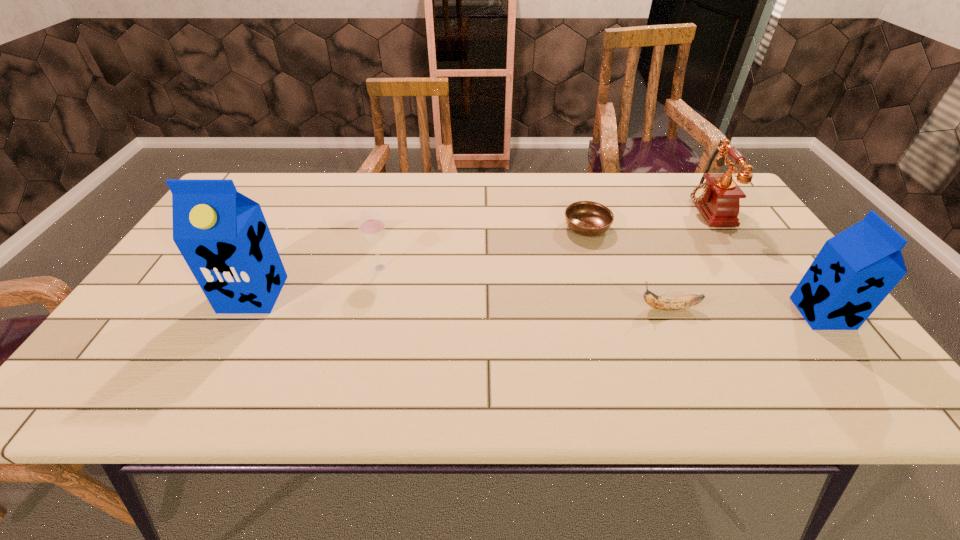
You are a GUI agent. You are given a task and a screenshot of the screen. Output one action in this format:
    pyautogui.click(x=<x>, y=<y>)
    Task: Click on the free space at the near left corner of the desktop
    Image resolution: width=960 pixels, height=540 pixels.
    Given the screenshot: What is the action you would take?
    pyautogui.click(x=129, y=349)

Where is `vacant region at the far right corner of the desktop`? This screenshot has height=540, width=960. vacant region at the far right corner of the desktop is located at coordinates (686, 204).

The height and width of the screenshot is (540, 960). Identify the location of free space at the near right corner of the desktop. (827, 336).

Find the location of `vacant area that lies between the third tallest object and the banana`. vacant area that lies between the third tallest object and the banana is located at coordinates (686, 258).

At what (x,y) coordinates should I click in order to perform the action: click on blank region between the wineglass and the shorter carton. Please return your answer as a coordinate pair (x, y). The image size is (960, 540). Looking at the image, I should click on (601, 291).

Image resolution: width=960 pixels, height=540 pixels. I want to click on blank region between the fifth object from left to right and the leftmost object, so click(x=479, y=251).

Where is `free space between the leftmost object and the fifth tallest object`? Image resolution: width=960 pixels, height=540 pixels. free space between the leftmost object and the fifth tallest object is located at coordinates (461, 301).

Find the location of `free space between the soup bowl and the leftmost object`. free space between the soup bowl and the leftmost object is located at coordinates (420, 261).

This screenshot has height=540, width=960. I want to click on empty location between the telephone and the shortest object, so click(645, 218).

Find the location of `free spot between the fifth tallest object and the shortest object`. free spot between the fifth tallest object and the shortest object is located at coordinates (628, 268).